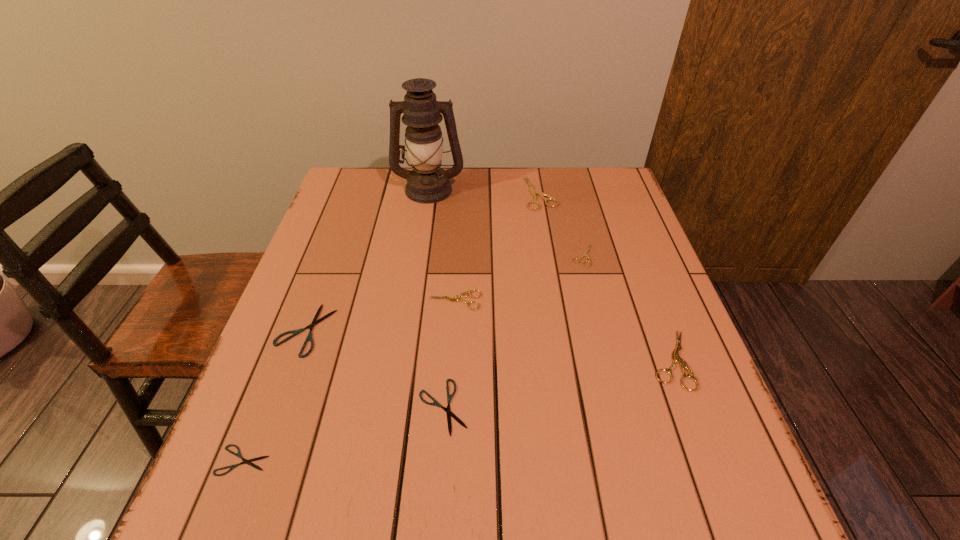
You are a GUI agent. You are given a task and a screenshot of the screen. Output one action in this format:
    pyautogui.click(x=<x>, y=<y>)
    Task: Click on the vacant space that satisfies the following two spatial constraints: 1. on the back side of the farthest shears; 2. on the right side of the rightmost black shears
    The image size is (960, 540).
    Given the screenshot: What is the action you would take?
    pyautogui.click(x=457, y=193)

Locate an element on the screen. blank area in the image that satisfies the following two spatial constraints: 1. on the front side of the nearest beige shears; 2. on the right side of the sixth nearest shears is located at coordinates (610, 360).